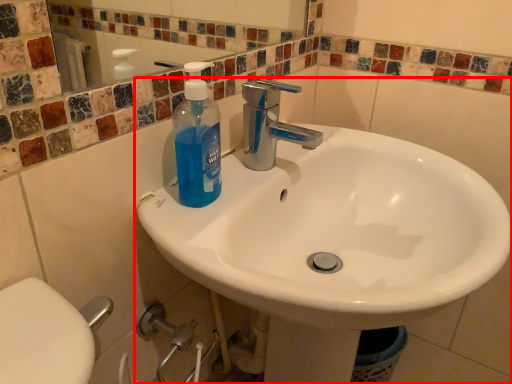
Question: Considering the relative positions of sink (annotated by the red box) and cleaning product in the image provided, where is sink (annotated by the red box) located with respect to the staircase?

Choices:
 (A) right
 (B) left

Answer: (A)